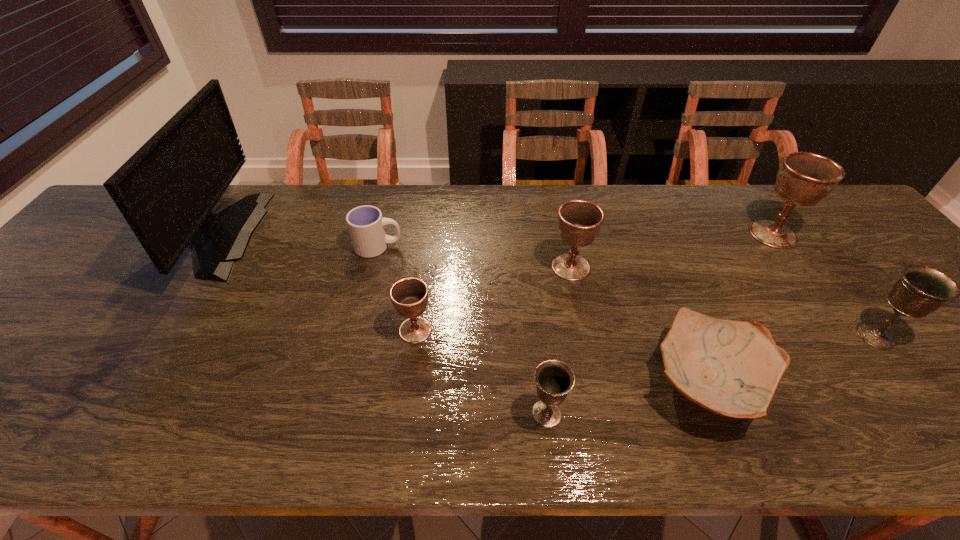
The width and height of the screenshot is (960, 540). In order to click on the smaller bronze chalice in this screenshot , I will do `click(554, 379)`.

In order to click on the nearest chalice in this screenshot , I will do `click(554, 379)`.

Find the location of a particular element. cup is located at coordinates (366, 225).

The image size is (960, 540). Identify the location of the sixth object from left to right. (732, 368).

Locate an element on the screen. vacant space situated 0.380m on the screen side of the leftmost object is located at coordinates [389, 234].

Locate an element on the screen. This screenshot has height=540, width=960. vacant area located 0.110m on the front of the farthest chalice is located at coordinates (804, 279).

The image size is (960, 540). I want to click on vacant space located on the left of the farther bronze chalice, so click(x=745, y=335).

What are the coordinates of `free space located on the left of the third chalice from right to left` in the screenshot? It's located at (433, 267).

At what (x,y) coordinates should I click in order to perform the action: click on free space located 0.160m on the front of the nearest brown chalice. Please return your answer as a coordinate pair (x, y). Image resolution: width=960 pixels, height=540 pixels. Looking at the image, I should click on (405, 411).

Identify the location of free location located 0.150m on the right of the second chalice from left to right. The height and width of the screenshot is (540, 960). (640, 414).